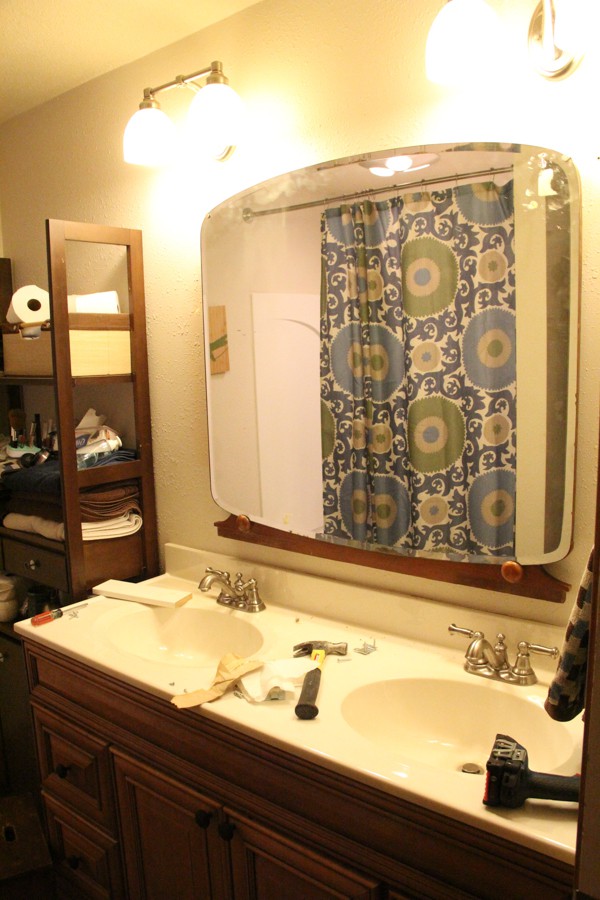
You are a GUI agent. You are given a task and a screenshot of the screen. Output one action in this format:
    pyautogui.click(x=<x>, y=<y>)
    Task: Click on the mirror
    
    Given the screenshot: What is the action you would take?
    pyautogui.click(x=266, y=256)